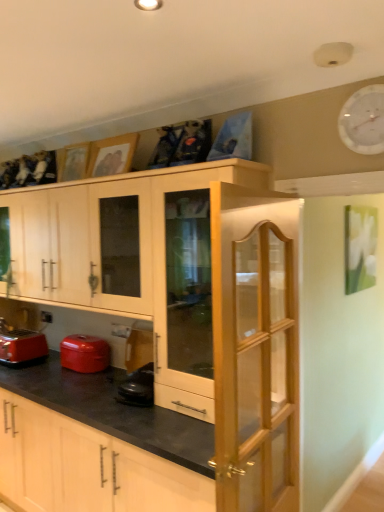
Question: Is matte wood cabinet at lower center surrounded by light wood/glass cabinet door at center?

Choices:
 (A) no
 (B) yes

Answer: (A)

Question: Does light wood/glass cabinet door at center have a greater width compared to matte wood cabinet at lower center?

Choices:
 (A) yes
 (B) no

Answer: (B)

Question: Is light wood/glass cabinet door at center at the right side of matte wood cabinet at lower center?

Choices:
 (A) yes
 (B) no

Answer: (A)

Question: Is light wood/glass cabinet door at center to the left of matte wood cabinet at lower center from the viewer's perspective?

Choices:
 (A) no
 (B) yes

Answer: (A)

Question: Are light wood/glass cabinet door at center and matte wood cabinet at lower center located far from each other?

Choices:
 (A) yes
 (B) no

Answer: (B)

Question: From the image's perspective, is light wood/glass cabinet door at center under matte wood cabinet at lower center?

Choices:
 (A) yes
 (B) no

Answer: (B)

Question: Would you say matte red toaster at lower left is part of wooden picture frame at upper center, the second picture frame in the left-to-right sequence,'s contents?

Choices:
 (A) no
 (B) yes

Answer: (A)

Question: Can you confirm if wooden picture frame at upper center, the first picture frame from the front, is shorter than matte red toaster at lower left?

Choices:
 (A) yes
 (B) no

Answer: (B)

Question: Is wooden picture frame at upper center, the second picture frame in the left-to-right sequence, to the left of matte red toaster at lower left from the viewer's perspective?

Choices:
 (A) yes
 (B) no

Answer: (B)

Question: From a real-world perspective, is wooden picture frame at upper center, the first picture frame from the front, over matte red toaster at lower left?

Choices:
 (A) no
 (B) yes

Answer: (B)

Question: Does wooden picture frame at upper center, the first picture frame from the front, have a greater width compared to matte red toaster at lower left?

Choices:
 (A) yes
 (B) no

Answer: (B)

Question: Is wooden picture frame at upper center, which appears as the second picture frame when viewed from the back, at the right side of matte red toaster at lower left?

Choices:
 (A) no
 (B) yes

Answer: (B)

Question: From the image's perspective, is matte red pot at lower left located above light wood/glass cabinet door at center?

Choices:
 (A) no
 (B) yes

Answer: (A)